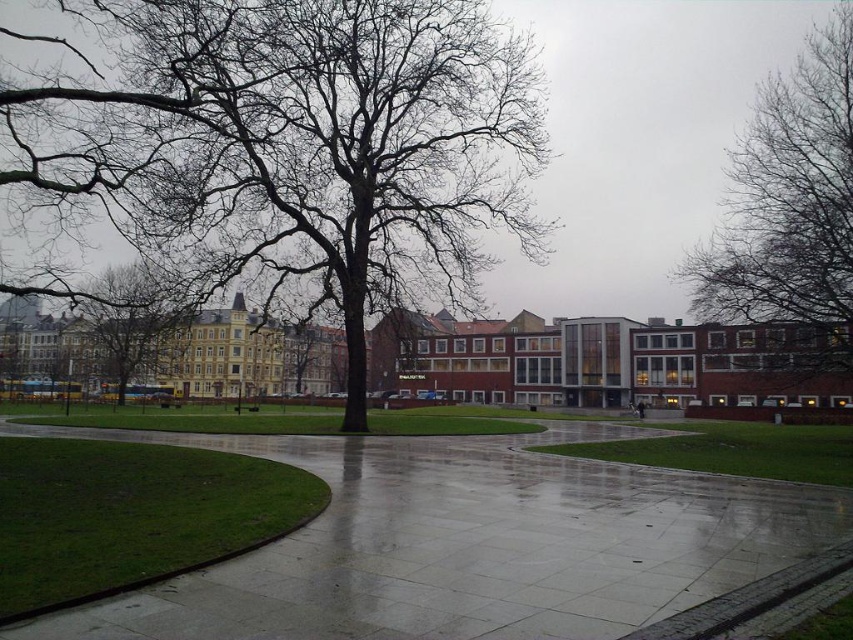
You are a delivery person trying to navigate through the urban park. You need to deliver a package to the address located at the base of the tree in the center. You see the glossy concrete pavement at center and the bare branches at upper right. Which object should you walk towards first to reach the tree?

You should walk towards the glossy concrete pavement at center first because it is located to the left of the bare branches at upper right, meaning it is closer to the central tree.

Looking at this image, you are standing at the center of the park and want to walk to the point closer to the camera between point (119, 12) and point (125, 321). Which point should you head towards?

You should head towards point (119, 12) because it is closer to the camera than point (125, 321).